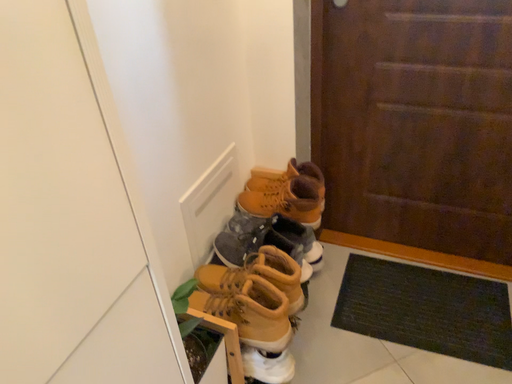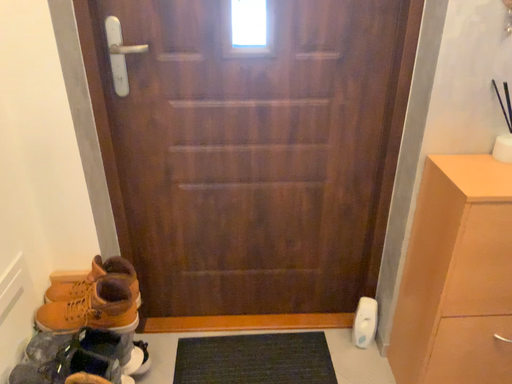
Question: How did the camera likely rotate when shooting the video?

Choices:
 (A) rotated upward
 (B) rotated downward

Answer: (A)